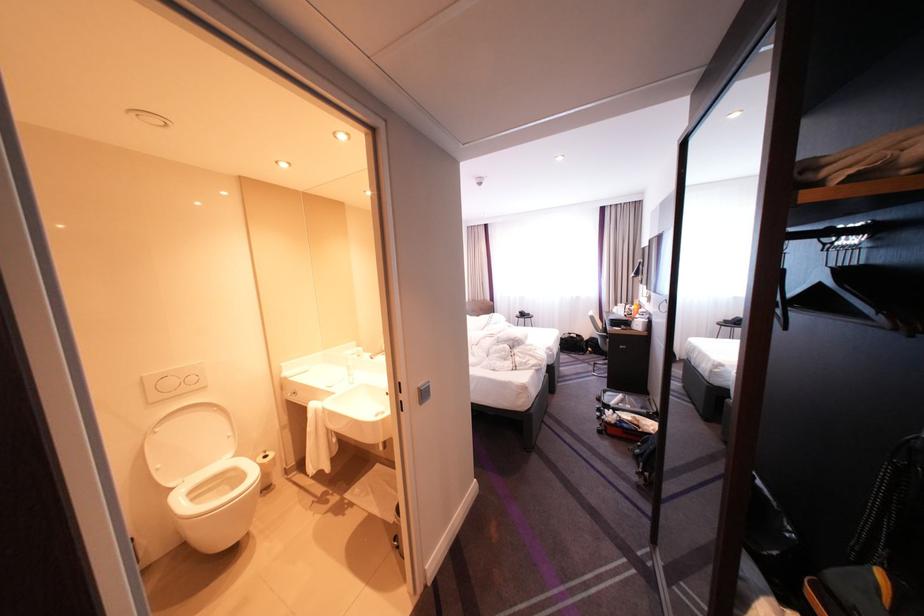
What do you see at coordinates (174, 384) in the screenshot?
I see `a white flush buttons` at bounding box center [174, 384].